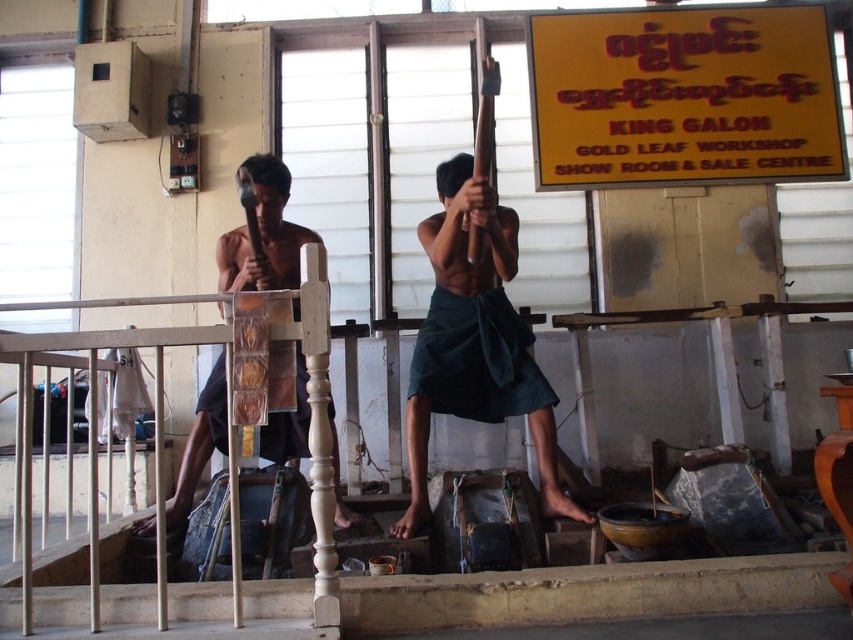
Is green fabric at center to the right of white wooden railing at center from the viewer's perspective?

Indeed, green fabric at center is positioned on the right side of white wooden railing at center.

Does green fabric at center have a greater height compared to white wooden railing at center?

Yes, green fabric at center is taller than white wooden railing at center.

Who is more forward, (482,392) or (234,609)?

Point (234,609) is in front.

This screenshot has height=640, width=853. What are the coordinates of `green fabric at center` in the screenshot? It's located at (474, 340).

Is point (665, 17) positioned before point (225, 326)?

No, it is not.

Which is behind, point (547, 16) or point (65, 307)?

The point (547, 16) is more distant.

Which is behind, point (828, 147) or point (202, 330)?

The point (828, 147) is more distant.

Where is `yellow paper sign at upper right`? yellow paper sign at upper right is located at coordinates (683, 97).

Is point (793, 164) closer to camera compared to point (241, 234)?

No, it is behind (241, 234).

Is yellow paper sign at upper right thinner than dark green fabric at center?

No.

Measure the distance between yellow paper sign at upper right and camera.

yellow paper sign at upper right and camera are 4.25 meters apart.

I want to click on yellow paper sign at upper right, so click(x=683, y=97).